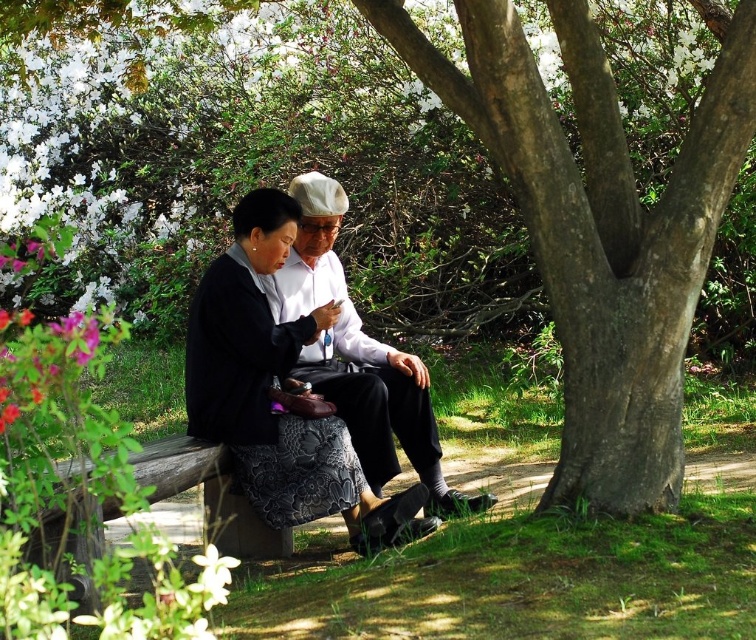
You are a photographer trying to capture a closeup of the white matte flower at lower center without including the matte black jacket at center in the frame. Based on their positions, can you position yourself in a way to achieve this?

The matte black jacket at center is positioned on the right side of the white matte flower at lower center. To avoid including the jacket, you should position yourself to the right of the flower so that the jacket is out of the frame.

You are a photographer trying to capture a photo of the smooth bark tree at center and the white cotton shirt at center. Which object should you focus on first if you want to ensure both are in focus without adjusting the camera settings?

The smooth bark tree at center is taller than the white cotton shirt at center, so you should focus on the smooth bark tree at center first since it is farther away. This will ensure the white cotton shirt at center is also in focus due to the depth of field extending backward.